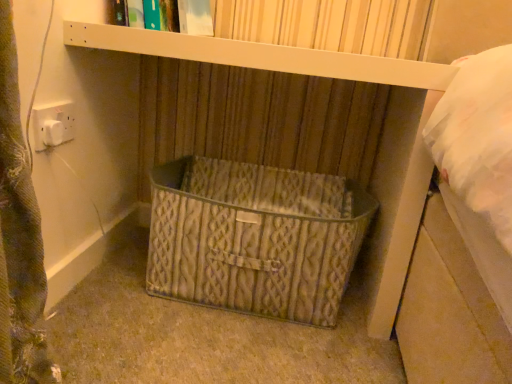
In order to face rustic metal basket at center, should I rotate leftwards or rightwards?

To align with it, rotate right about 0.101°.

Identify the location of rustic metal basket at center. (255, 237).

This screenshot has width=512, height=384. What do you see at coordinates (255, 237) in the screenshot? I see `rustic metal basket at center` at bounding box center [255, 237].

You are a GUI agent. You are given a task and a screenshot of the screen. Output one action in this format:
    pyautogui.click(x=<x>, y=<y>)
    Task: Click on the hardcover book at upper center
    
    Given the screenshot: What is the action you would take?
    pyautogui.click(x=165, y=15)

What do you see at coordinates (165, 15) in the screenshot? I see `hardcover book at upper center` at bounding box center [165, 15].

The image size is (512, 384). What are the coordinates of `rustic metal basket at center` in the screenshot? It's located at (255, 237).

Which object is positioned more to the left, rustic metal basket at center or hardcover book at upper center?

hardcover book at upper center is more to the left.

Which object is further away from the camera, rustic metal basket at center or hardcover book at upper center?

Positioned behind is hardcover book at upper center.

Which is in front, point (211, 189) or point (116, 15)?

Positioned in front is point (116, 15).

From the image's perspective, who appears lower, rustic metal basket at center or hardcover book at upper center?

rustic metal basket at center.

From a real-world perspective, does rustic metal basket at center stand above hardcover book at upper center?

No.

Looking at their sizes, would you say rustic metal basket at center is wider or thinner than hardcover book at upper center?

Clearly, rustic metal basket at center has more width compared to hardcover book at upper center.

Which of these two, rustic metal basket at center or hardcover book at upper center, stands taller?

rustic metal basket at center is taller.

Can you confirm if rustic metal basket at center is bigger than hardcover book at upper center?

Yes.

Is rustic metal basket at center situated inside hardcover book at upper center or outside?

rustic metal basket at center lies outside hardcover book at upper center.

Is rustic metal basket at center next to hardcover book at upper center?

No, rustic metal basket at center is not next to hardcover book at upper center.

Does rustic metal basket at center turn towards hardcover book at upper center?

No, rustic metal basket at center is not turned towards hardcover book at upper center.

What's the angular difference between rustic metal basket at center and hardcover book at upper center's facing directions?

There is a 0.00104-degree angle between the facing directions of rustic metal basket at center and hardcover book at upper center.

The image size is (512, 384). Identify the location of book on the left side of rustic metal basket at center. (165, 15).

Is hardcover book at upper center at the right side of rustic metal basket at center?

No.

Considering the positions of objects hardcover book at upper center and rustic metal basket at center in the image provided, who is in front, hardcover book at upper center or rustic metal basket at center?

rustic metal basket at center is more forward.

Which is farther, (183, 26) or (332, 308)?

Positioned behind is point (183, 26).

From the image's perspective, which object appears higher, hardcover book at upper center or rustic metal basket at center?

hardcover book at upper center, from the image's perspective.

From a real-world perspective, does hardcover book at upper center stand above rustic metal basket at center?

Yes, from a real-world perspective, hardcover book at upper center is on top of rustic metal basket at center.

Considering the sizes of hardcover book at upper center and rustic metal basket at center in the image, is hardcover book at upper center wider or thinner than rustic metal basket at center?

In the image, hardcover book at upper center appears to be more narrow than rustic metal basket at center.

Based on the photo, from their relative heights in the image, would you say hardcover book at upper center is taller or shorter than rustic metal basket at center?

hardcover book at upper center is shorter than rustic metal basket at center.

Considering the sizes of hardcover book at upper center and rustic metal basket at center in the image, is hardcover book at upper center bigger or smaller than rustic metal basket at center?

Clearly, hardcover book at upper center is smaller in size than rustic metal basket at center.

Which is correct: hardcover book at upper center is inside rustic metal basket at center, or outside of it?

hardcover book at upper center lies outside rustic metal basket at center.

Is hardcover book at upper center not close to rustic metal basket at center?

hardcover book at upper center is near rustic metal basket at center, not far away.

Is hardcover book at upper center aimed at rustic metal basket at center?

No, hardcover book at upper center is not facing towards rustic metal basket at center.

The width and height of the screenshot is (512, 384). I want to click on basket in front of the hardcover book at upper center, so click(255, 237).

You are a GUI agent. You are given a task and a screenshot of the screen. Output one action in this format:
    pyautogui.click(x=<x>, y=<y>)
    Task: Click on the basket located underneath the hardcover book at upper center (from a real-world perspective)
    The height and width of the screenshot is (384, 512).
    Given the screenshot: What is the action you would take?
    pyautogui.click(x=255, y=237)

Where is `basket below the hardcover book at upper center (from the image's perspective)`? Image resolution: width=512 pixels, height=384 pixels. basket below the hardcover book at upper center (from the image's perspective) is located at coordinates (255, 237).